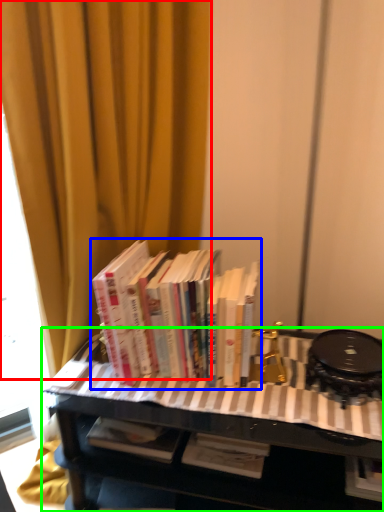
Question: Which object is the closest to the curtain (highlighted by a red box)? Choose among these: book (highlighted by a blue box) or table (highlighted by a green box).

Choices:
 (A) book
 (B) table

Answer: (A)